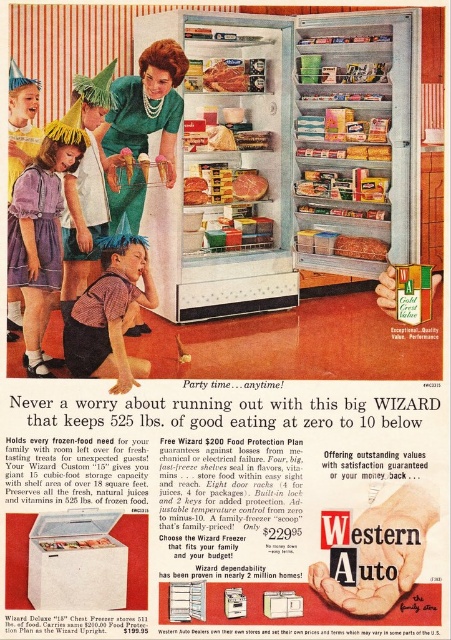
Measure the distance between purple cotton dress at lower left and smooth plastic container at center.

They are 5.50 feet apart.

Is point (13, 246) more distant than point (216, 72)?

No.

What do you see at coordinates (41, 234) in the screenshot? I see `purple cotton dress at lower left` at bounding box center [41, 234].

The width and height of the screenshot is (451, 640). What are the coordinates of `purple cotton dress at lower left` in the screenshot? It's located at (41, 234).

Can you confirm if white metallic refrigerator at center is positioned to the left of purple cotton dress at lower left?

In fact, white metallic refrigerator at center is to the right of purple cotton dress at lower left.

Is white metallic refrigerator at center to the right of purple cotton dress at lower left from the viewer's perspective?

Yes, white metallic refrigerator at center is to the right of purple cotton dress at lower left.

Who is more distant from viewer, (405, 108) or (67, 124)?

Point (405, 108)

Find the location of a particular element. white metallic refrigerator at center is located at coordinates (285, 156).

Does white metallic refrigerator at center have a greater height compared to smoked meat at center?

Correct, white metallic refrigerator at center is much taller as smoked meat at center.

Consider the image. Measure the distance between point [377,45] and camera.

A distance of 4.19 meters exists between point [377,45] and camera.

Where is `white metallic refrigerator at center`? Image resolution: width=451 pixels, height=640 pixels. white metallic refrigerator at center is located at coordinates (285, 156).